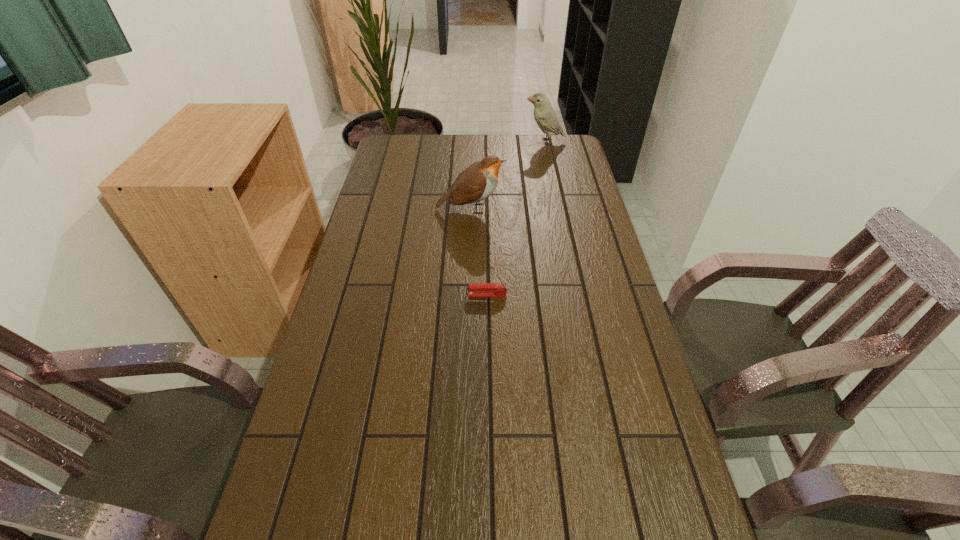
The height and width of the screenshot is (540, 960). Identify the location of the rightmost object. (544, 114).

Find the location of `the right bird`. the right bird is located at coordinates (544, 114).

Identify the location of the nearer bird. (478, 181).

Image resolution: width=960 pixels, height=540 pixels. Identify the location of the left bird. (478, 181).

At what (x,y) coordinates should I click in order to perform the action: click on stapler. Please return your answer as a coordinate pair (x, y). Image resolution: width=960 pixels, height=540 pixels. Looking at the image, I should click on (479, 289).

Identify the location of the shortest object. (479, 289).

Locate an element on the screen. The image size is (960, 540). vacant area located at the face of the farther bird is located at coordinates (433, 141).

Where is `free location located at the face of the farther bird`? The width and height of the screenshot is (960, 540). free location located at the face of the farther bird is located at coordinates (457, 141).

Locate an element on the screen. free region located at the face of the farther bird is located at coordinates (471, 141).

I want to click on vacant space situated at the face of the left bird, so click(x=568, y=208).